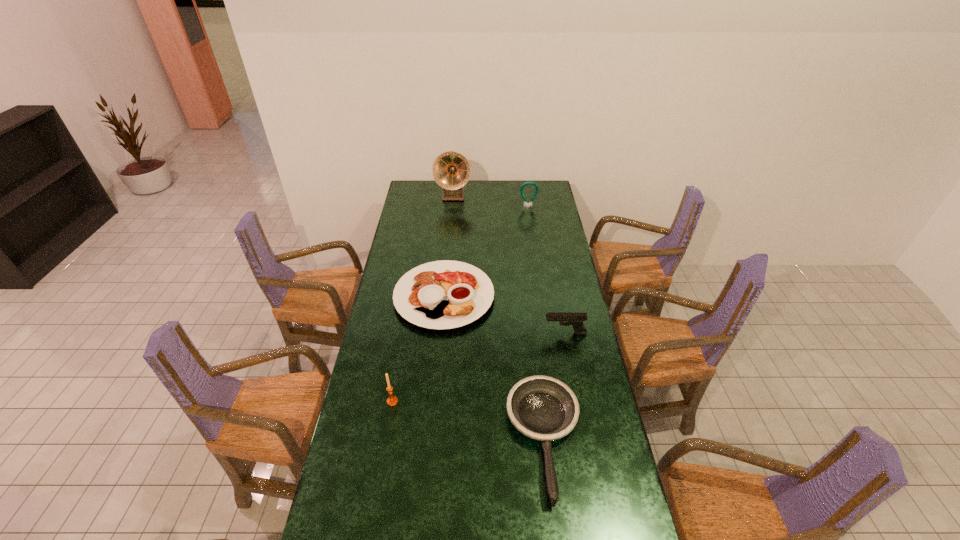
Identify which object is located as the third nearest to the candle_holder. Please provide its 2D coordinates. Your answer should be formatted as a tuple, i.e. [(x, y)], where the tuple contains the x and y coordinates of a point satisfying the conditions above.

[(576, 320)]

I want to click on vacant area that satisfies the following two spatial constraints: 1. on the front-facing side of the pistol; 2. on the handle side of the frying pan, so click(586, 440).